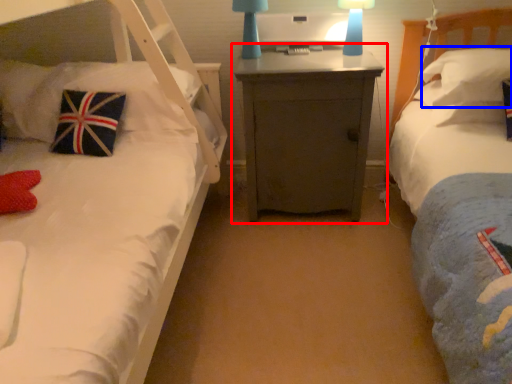
Question: Which point is closer to the camera, nightstand (highlighted by a red box) or pillow (highlighted by a blue box)?

Choices:
 (A) nightstand
 (B) pillow

Answer: (B)